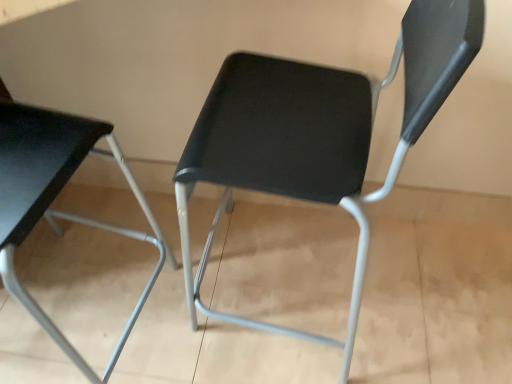
At what (x,y) coordinates should I click in order to perform the action: click on matte black chair at center, positioned as the 2th chair in left-to-right order. Please return your answer as a coordinate pair (x, y). Looking at the image, I should click on (318, 133).

In order to face matte black chair at center, the first chair in the right-to-left sequence, should I rotate leftwards or rightwards?

You should rotate right by 5.452 degrees.

Measure the distance between point (x=357, y=146) and camera.

74.80 centimeters.

The width and height of the screenshot is (512, 384). What do you see at coordinates (318, 133) in the screenshot?
I see `matte black chair at center, positioned as the 2th chair in left-to-right order` at bounding box center [318, 133].

Image resolution: width=512 pixels, height=384 pixels. I want to click on matte black chair at left, arranged as the 1th chair when viewed from the left, so click(54, 198).

Describe the element at coordinates (54, 198) in the screenshot. I see `matte black chair at left, arranged as the 1th chair when viewed from the left` at that location.

Identify the location of matte black chair at center, positioned as the 2th chair in left-to-right order. (318, 133).

Between matte black chair at center, the first chair in the right-to-left sequence, and matte black chair at left, which is counted as the 2th chair, starting from the right, which one appears on the left side from the viewer's perspective?

matte black chair at left, which is counted as the 2th chair, starting from the right.

Relative to matte black chair at left, which is counted as the 2th chair, starting from the right, is matte black chair at center, the first chair in the right-to-left sequence, in front or behind?

Clearly, matte black chair at center, the first chair in the right-to-left sequence, is behind matte black chair at left, which is counted as the 2th chair, starting from the right.

Is point (362, 84) closer or farther from the camera than point (147, 211)?

Point (362, 84) is closer to the camera than point (147, 211).

From the image's perspective, between matte black chair at center, the first chair in the right-to-left sequence, and matte black chair at left, which is counted as the 2th chair, starting from the right, who is located below?

matte black chair at left, which is counted as the 2th chair, starting from the right, from the image's perspective.

From a real-world perspective, between matte black chair at center, the first chair in the right-to-left sequence, and matte black chair at left, which is counted as the 2th chair, starting from the right, who is vertically lower?

matte black chair at center, the first chair in the right-to-left sequence, is physically lower.

Which of these two, matte black chair at center, positioned as the 2th chair in left-to-right order, or matte black chair at left, which is counted as the 2th chair, starting from the right, is thinner?

Thinner between the two is matte black chair at center, positioned as the 2th chair in left-to-right order.

Who is shorter, matte black chair at center, the first chair in the right-to-left sequence, or matte black chair at left, which is counted as the 2th chair, starting from the right?

Standing shorter between the two is matte black chair at left, which is counted as the 2th chair, starting from the right.

Does matte black chair at center, positioned as the 2th chair in left-to-right order, have a smaller size compared to matte black chair at left, which is counted as the 2th chair, starting from the right?

Indeed, matte black chair at center, positioned as the 2th chair in left-to-right order, has a smaller size compared to matte black chair at left, which is counted as the 2th chair, starting from the right.

Is matte black chair at center, positioned as the 2th chair in left-to-right order, completely or partially outside of matte black chair at left, arranged as the 1th chair when viewed from the left?

matte black chair at center, positioned as the 2th chair in left-to-right order, lies outside matte black chair at left, arranged as the 1th chair when viewed from the left,'s area.

Is matte black chair at center, the first chair in the right-to-left sequence, far away from matte black chair at left, which is counted as the 2th chair, starting from the right?

No, matte black chair at center, the first chair in the right-to-left sequence, is not far from matte black chair at left, which is counted as the 2th chair, starting from the right.

Looking at this image, is matte black chair at center, the first chair in the right-to-left sequence, oriented towards matte black chair at left, arranged as the 1th chair when viewed from the left?

Yes, matte black chair at center, the first chair in the right-to-left sequence, is facing matte black chair at left, arranged as the 1th chair when viewed from the left.

What's the angular difference between matte black chair at center, the first chair in the right-to-left sequence, and matte black chair at left, arranged as the 1th chair when viewed from the left,'s facing directions?

matte black chair at center, the first chair in the right-to-left sequence, and matte black chair at left, arranged as the 1th chair when viewed from the left, are facing 96.1 degrees away from each other.

Find the location of a particular element. This screenshot has width=512, height=384. chair located above the matte black chair at left, arranged as the 1th chair when viewed from the left (from the image's perspective) is located at coordinates (318, 133).

Considering the relative positions of matte black chair at left, which is counted as the 2th chair, starting from the right, and matte black chair at center, the first chair in the right-to-left sequence, in the image provided, is matte black chair at left, which is counted as the 2th chair, starting from the right, to the left of matte black chair at center, the first chair in the right-to-left sequence, from the viewer's perspective?

Indeed, matte black chair at left, which is counted as the 2th chair, starting from the right, is positioned on the left side of matte black chair at center, the first chair in the right-to-left sequence.

Does matte black chair at left, which is counted as the 2th chair, starting from the right, lie in front of matte black chair at center, the first chair in the right-to-left sequence?

Yes, it is.

Is point (58, 145) closer or farther from the camera than point (204, 271)?

Point (58, 145).

From the image's perspective, is matte black chair at left, which is counted as the 2th chair, starting from the right, on top of matte black chair at center, the first chair in the right-to-left sequence?

No, from the image's perspective, matte black chair at left, which is counted as the 2th chair, starting from the right, is not on top of matte black chair at center, the first chair in the right-to-left sequence.

From a real-world perspective, is matte black chair at left, arranged as the 1th chair when viewed from the left, located beneath matte black chair at center, the first chair in the right-to-left sequence?

No.

Based on the photo, does matte black chair at left, arranged as the 1th chair when viewed from the left, have a greater width compared to matte black chair at center, the first chair in the right-to-left sequence?

Correct, the width of matte black chair at left, arranged as the 1th chair when viewed from the left, exceeds that of matte black chair at center, the first chair in the right-to-left sequence.

Considering the sizes of objects matte black chair at left, arranged as the 1th chair when viewed from the left, and matte black chair at center, positioned as the 2th chair in left-to-right order, in the image provided, who is shorter, matte black chair at left, arranged as the 1th chair when viewed from the left, or matte black chair at center, positioned as the 2th chair in left-to-right order,?

matte black chair at left, arranged as the 1th chair when viewed from the left.

Considering the relative sizes of matte black chair at left, arranged as the 1th chair when viewed from the left, and matte black chair at center, the first chair in the right-to-left sequence, in the image provided, is matte black chair at left, arranged as the 1th chair when viewed from the left, bigger than matte black chair at center, the first chair in the right-to-left sequence,?

Yes, matte black chair at left, arranged as the 1th chair when viewed from the left, is bigger than matte black chair at center, the first chair in the right-to-left sequence.

Is matte black chair at center, positioned as the 2th chair in left-to-right order, inside matte black chair at left, arranged as the 1th chair when viewed from the left?

That's incorrect, matte black chair at center, positioned as the 2th chair in left-to-right order, is not inside matte black chair at left, arranged as the 1th chair when viewed from the left.

Is matte black chair at left, arranged as the 1th chair when viewed from the left, not near matte black chair at center, the first chair in the right-to-left sequence?

matte black chair at left, arranged as the 1th chair when viewed from the left, is actually quite close to matte black chair at center, the first chair in the right-to-left sequence.

Is matte black chair at left, which is counted as the 2th chair, starting from the right, positioned with its back to matte black chair at center, positioned as the 2th chair in left-to-right order?

matte black chair at left, which is counted as the 2th chair, starting from the right, does not have its back to matte black chair at center, positioned as the 2th chair in left-to-right order.

This screenshot has height=384, width=512. I want to click on chair above the matte black chair at center, positioned as the 2th chair in left-to-right order (from a real-world perspective), so click(54, 198).

Locate an element on the screen. The height and width of the screenshot is (384, 512). chair above the matte black chair at left, arranged as the 1th chair when viewed from the left (from the image's perspective) is located at coordinates (318, 133).

Identify the location of chair behind the matte black chair at left, arranged as the 1th chair when viewed from the left. This screenshot has width=512, height=384. [x=318, y=133].